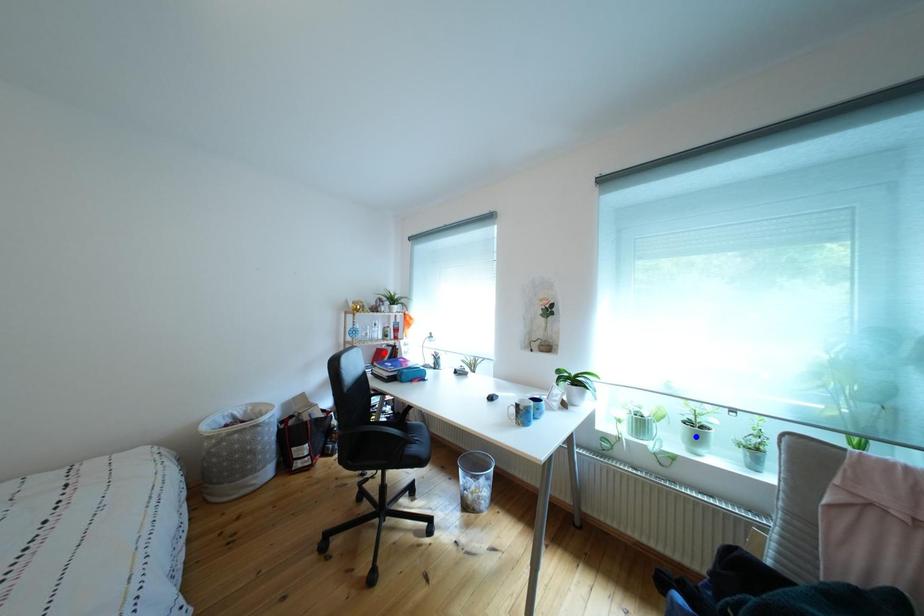
Question: In the image, two points are highlighted. Which point is nearer to the camera? Reply with the corresponding letter.

Choices:
 (A) blue point
 (B) red point

Answer: (A)